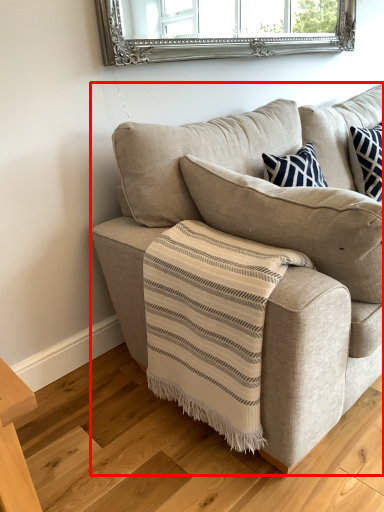
Question: From the image's perspective, considering the relative positions of studio couch (annotated by the red box) and stair in the image provided, where is studio couch (annotated by the red box) located with respect to the staircase?

Choices:
 (A) above
 (B) below

Answer: (A)